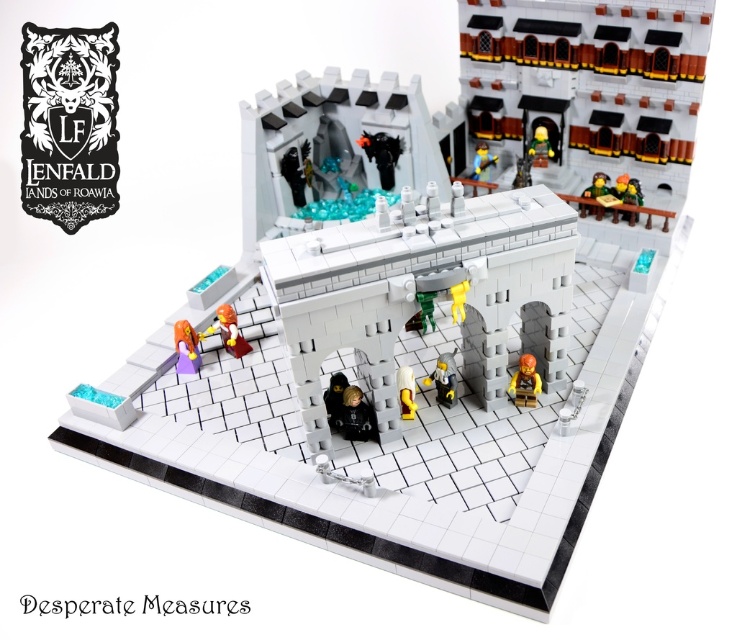
Question: Does purple matte figure at center come behind green plastic minifigure at upper right?

Choices:
 (A) yes
 (B) no

Answer: (B)

Question: Does smooth yellow minifigure at center appear under green plastic minifigure at upper right?

Choices:
 (A) yes
 (B) no

Answer: (A)

Question: Which of these objects is positioned farthest from the light brown wooden chair at upper right?

Choices:
 (A) green plastic minifigure at upper right
 (B) yellow plastic figure at center

Answer: (B)

Question: Which of the following is the closest to the observer?

Choices:
 (A) (590, 208)
 (B) (527, 152)
 (C) (478, 170)

Answer: (A)

Question: Which is farther from the yellow plastic figure at center?

Choices:
 (A) orange plastic minifigure at center
 (B) light brown wooden chair at upper right

Answer: (B)

Question: Can you confirm if purple matte figure at center is bigger than yellow plastic figure at center?

Choices:
 (A) yes
 (B) no

Answer: (A)